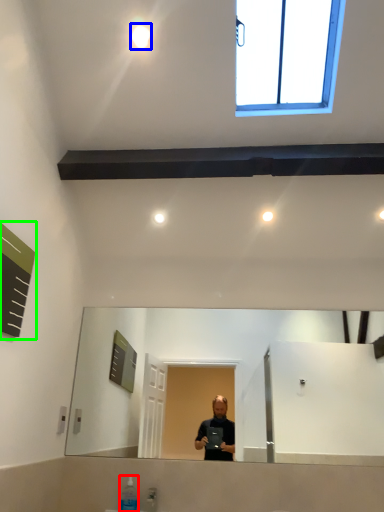
Question: Which is farther away from toiletry (highlighted by a red box)? lighting (highlighted by a blue box) or bulletin board (highlighted by a green box)?

Choices:
 (A) lighting
 (B) bulletin board

Answer: (A)